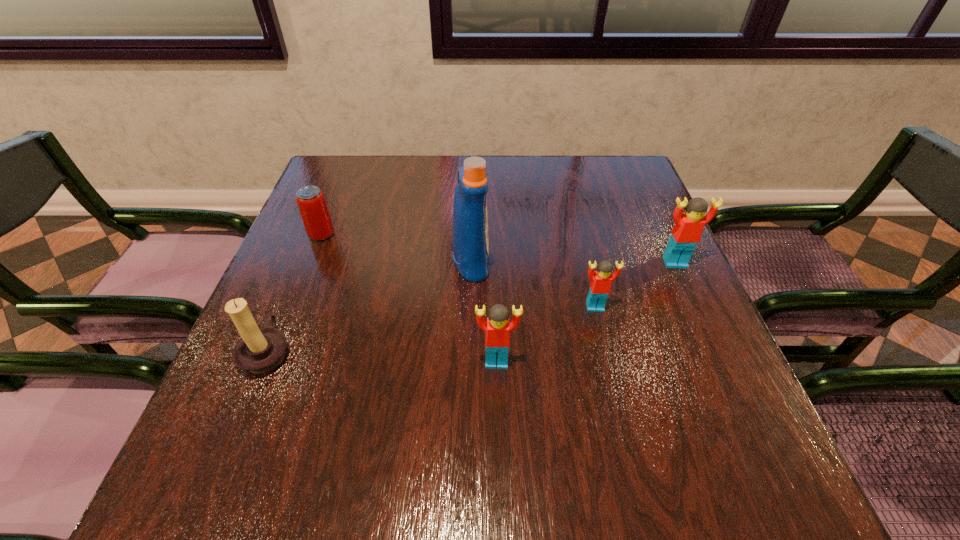
Please point a spot on the left to add another Lego. Please provide its 2D coordinates. Your answer should be formatted as a tuple, i.e. [(x, y)], where the tuple contains the x and y coordinates of a point satisfying the conditions above.

[(372, 430)]